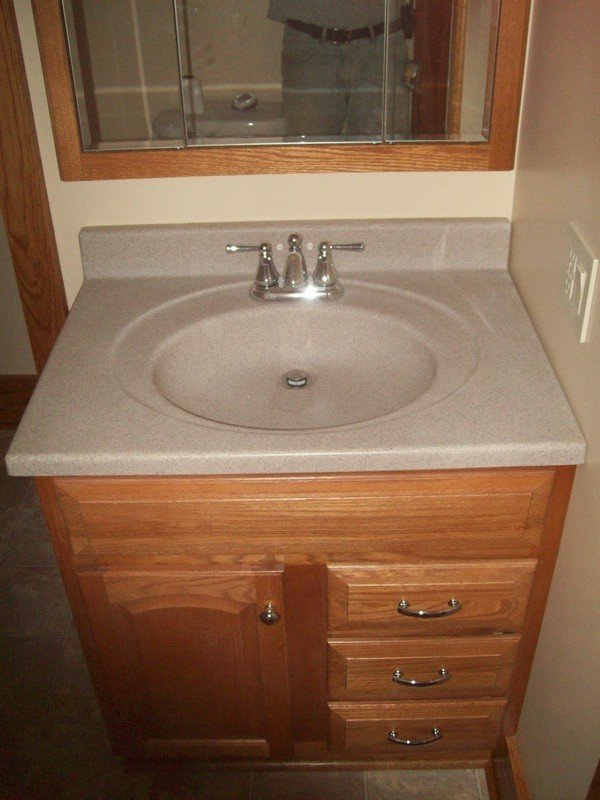
I want to click on drawers, so (x=381, y=596), (x=376, y=686), (x=374, y=734).